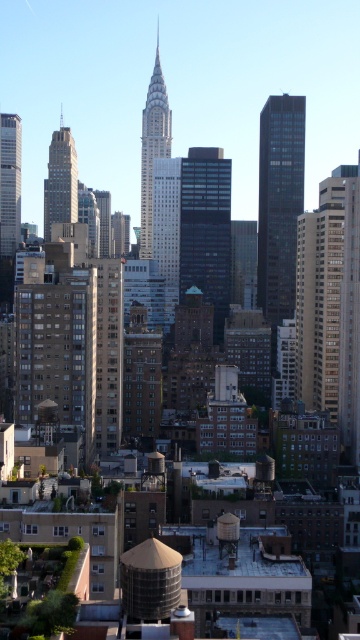
Which is behind, point (273, 268) or point (15, 189)?

Positioned behind is point (15, 189).

Image resolution: width=360 pixels, height=640 pixels. I want to click on dark glass skyscraper at upper right, so click(280, 202).

Looking at this image, who is higher up, dark glass skyscraper at upper right or matte brown building at left?

Positioned higher is matte brown building at left.

Image resolution: width=360 pixels, height=640 pixels. I want to click on dark glass skyscraper at upper right, so click(x=280, y=202).

Does point (349, 369) come behind point (149, 253)?

No, it is in front of (149, 253).

From the picture: Which is more to the left, gold glass skyscraper at center or shiny silver skyscraper at center?

Positioned to the left is shiny silver skyscraper at center.

Does point (330, 320) come in front of point (145, 211)?

Yes, it is.

The image size is (360, 640). Find the location of `gold glass skyscraper at center`. gold glass skyscraper at center is located at coordinates (330, 300).